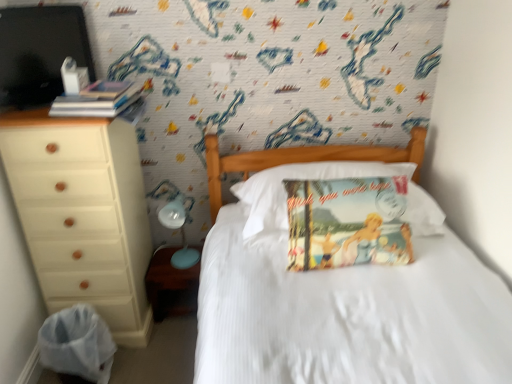
At what (x,y) coordinates should I click in order to perform the action: click on vacant space situated above hardcover books at left, the second book when ordered from right to left (from a real-world perspective). Please return your answer as a coordinate pair (x, y). This screenshot has height=384, width=512. Looking at the image, I should click on (98, 86).